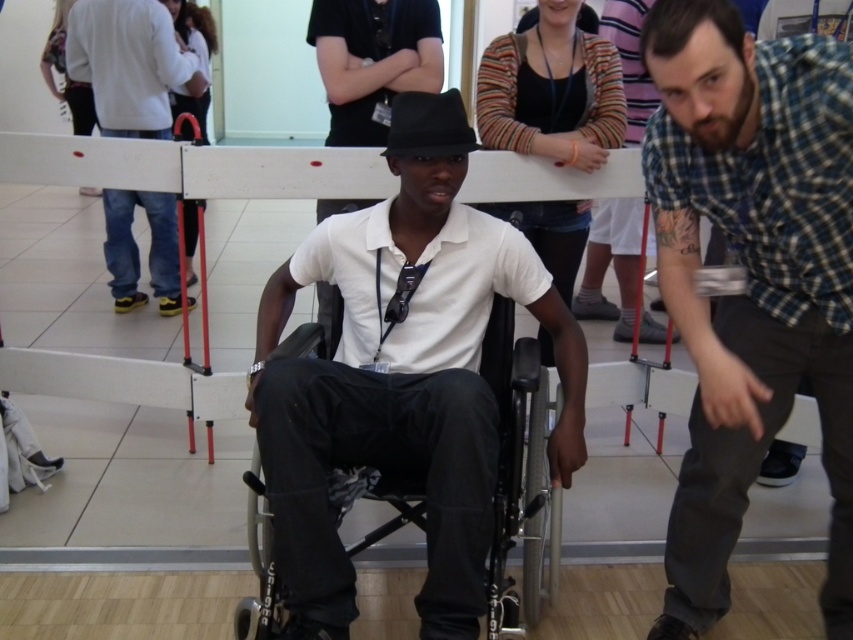
You are a photographer setting up a shoot in this room. You need to position a large lamp that casts a shadow. The lamp must be placed so that the shadow of the checkered fabric shirt at right does not fall on the black plastic wheelchair at center. Considering their heights, where should you place the lamp relative to these two objects?

The checkered fabric shirt at right is taller than the black plastic wheelchair at center. To prevent the shadow of the checkered fabric shirt at right from falling on the black plastic wheelchair at center, place the lamp behind the checkered fabric shirt at right. This way, the shadow will be cast away from the wheelchair.

You are a physical therapist assessing the space between the black plastic wheelchair at center and the jeans at left. The wheelchair needs to be moved 1 meter to the right. Is there enough space for this movement?

The black plastic wheelchair at center is smaller than jeans at left, but the description does not provide exact measurements of the space between them. Therefore, it is uncertain if there is enough space to move the wheelchair 1 meter to the right.